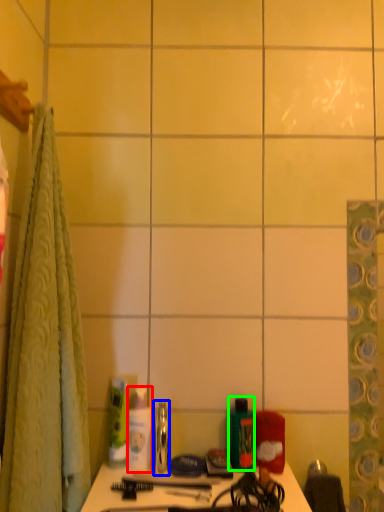
Question: Which object is the farthest from toiletry (highlighted by a red box)? Choose among these: mouthwash (highlighted by a blue box) or mouthwash (highlighted by a green box).

Choices:
 (A) mouthwash
 (B) mouthwash

Answer: (B)